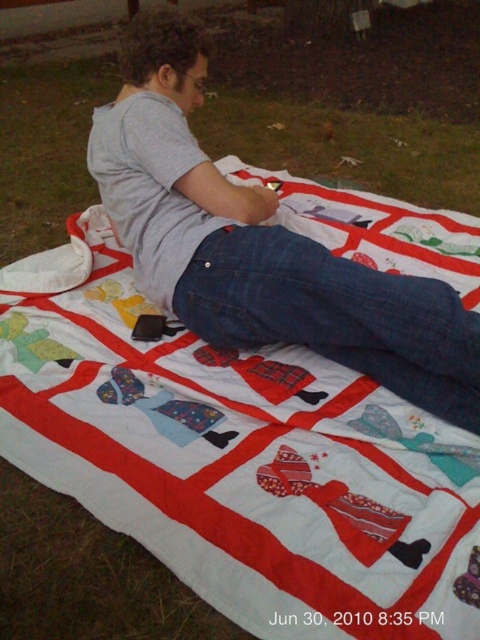
You are a tailor who needs to determine if the gray cotton shirt at upper center can be folded and placed inside the denim at center without any overlapping. Based on their widths, can this be done?

→ The gray cotton shirt at upper center might be wider than denim at center, so it is uncertain if it can be folded and placed inside without overlapping. Further measurement is needed.

You are a tailor measuring the distance between the gray cotton shirt at upper center and the denim at center. The minimum required distance for a safety pin is 2.5 inches. Can you safely attach a safety pin between them?

The gray cotton shirt at upper center and denim at center are 3.30 inches apart from each other, which is greater than the minimum required distance of 2.5 inches. Therefore, you can safely attach a safety pin between them.

You are a fashion designer observing the person in the image. You need to determine the spatial relationship between the gray cotton shirt at upper center and the denim at center. Which one is located to the left?

The gray cotton shirt at upper center is positioned on the left side of denim at center, so the gray cotton shirt at upper center is located to the left.